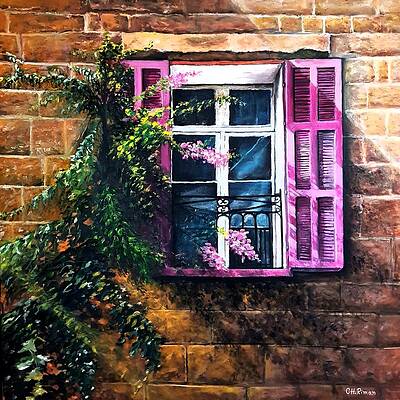
Where is `shutters`? The width and height of the screenshot is (400, 400). shutters is located at coordinates (313, 95), (163, 160).